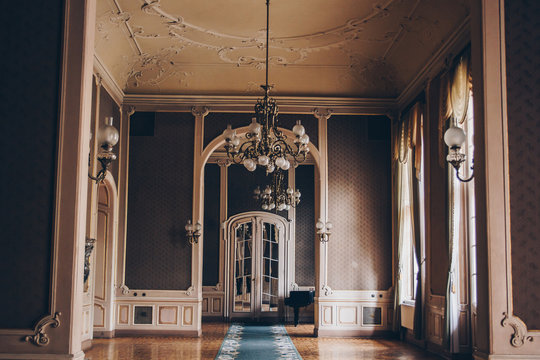
At what (x,y) coordinates should I click in order to perform the action: click on wall lights. Please return your answer as a coordinate pair (x, y). The height and width of the screenshot is (360, 540). Looking at the image, I should click on (454, 159), (114, 155).